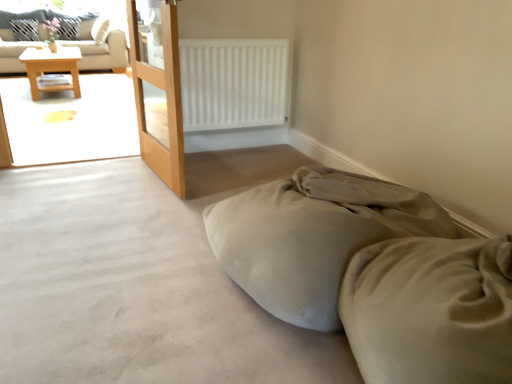
Question: From a real-world perspective, is beige fabric couch at upper left positioned above or below white matte radiator at upper center?

Choices:
 (A) below
 (B) above

Answer: (B)

Question: From the image's perspective, is beige fabric couch at upper left located above or below white matte radiator at upper center?

Choices:
 (A) above
 (B) below

Answer: (A)

Question: Which object is positioned farthest from the wooden screen door at left?

Choices:
 (A) suede-like beige bed at lower right
 (B) white matte radiator at upper center
 (C) beige fabric couch at upper left
 (D) white fabric pillow at upper left, which appears as the second pillow when viewed from the left
 (E) white fabric pillow at upper left, which is the second pillow in right-to-left order

Answer: (E)

Question: Which is nearer to the white matte radiator at upper center?

Choices:
 (A) beige fabric couch at upper left
 (B) wooden table at left
 (C) white fabric pillow at upper left, which appears as the second pillow when viewed from the left
 (D) wooden screen door at left
 (E) suede-like beige bed at lower right

Answer: (D)